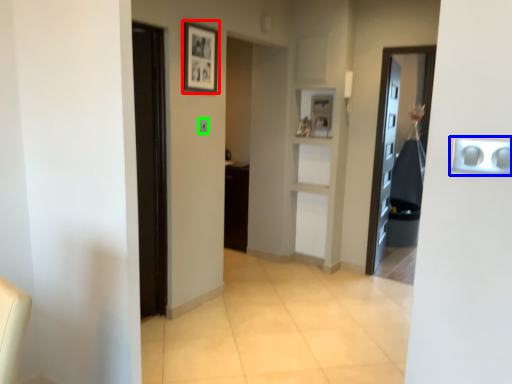
Question: Which object is the closest to the picture frame (highlighted by a red box)? Choose among these: door handle (highlighted by a blue box) or light switch (highlighted by a green box).

Choices:
 (A) door handle
 (B) light switch

Answer: (B)